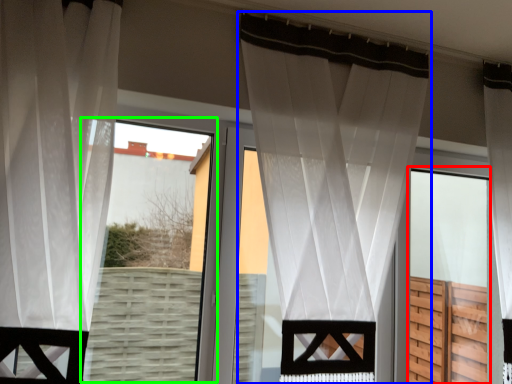
Question: Estimate the real-world distances between objects in this image. Which object is farther from screen door (highlighted by a red box), curtain (highlighted by a blue box) or bay window (highlighted by a green box)?

Choices:
 (A) curtain
 (B) bay window

Answer: (B)